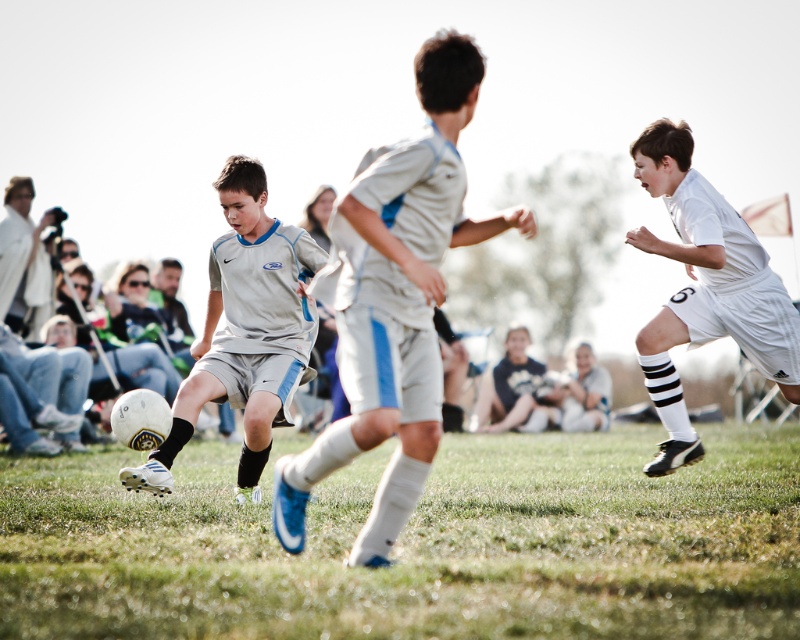
Question: Does green grass at center come behind white jersey at center?

Choices:
 (A) no
 (B) yes

Answer: (A)

Question: Which point is closer to the camera taking this photo?

Choices:
 (A) (525, 344)
 (B) (400, 220)
 (C) (564, 420)
 (D) (680, 413)

Answer: (B)

Question: Is light gray uniform at center behind dark blue jersey at center?

Choices:
 (A) yes
 (B) no

Answer: (B)

Question: Which of the following is the closest to the observer?

Choices:
 (A) white jersey at center
 (B) light gray uniform at center
 (C) white matte soccer uniform at right

Answer: (B)

Question: In this image, where is green grass at center located relative to white matte soccer uniform at right?

Choices:
 (A) below
 (B) above

Answer: (A)

Question: Estimate the real-world distances between objects in this image. Which object is closer to the white jersey at center?

Choices:
 (A) matte gray shorts at center
 (B) white matte soccer uniform at right
 (C) dark blue jersey at center
 (D) green grass at center

Answer: (C)